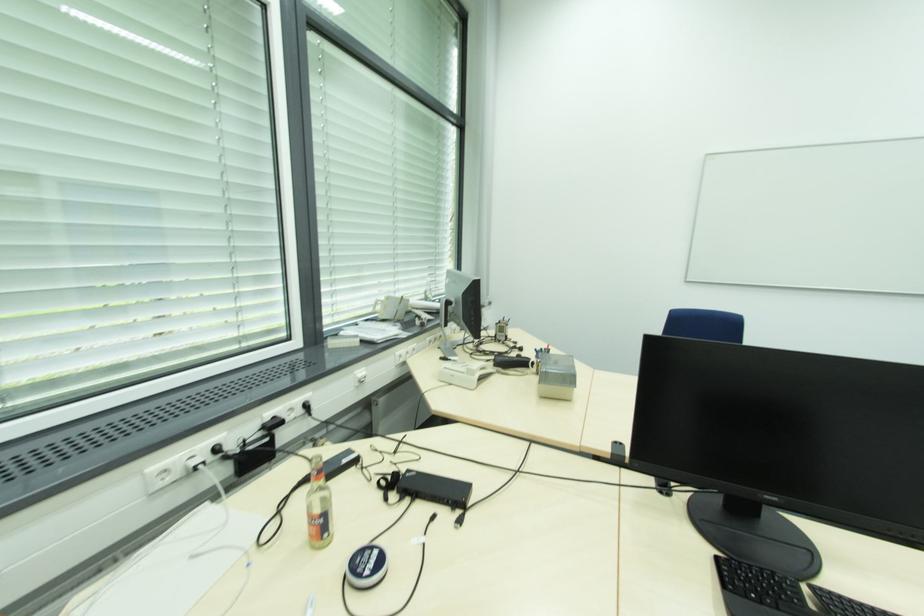
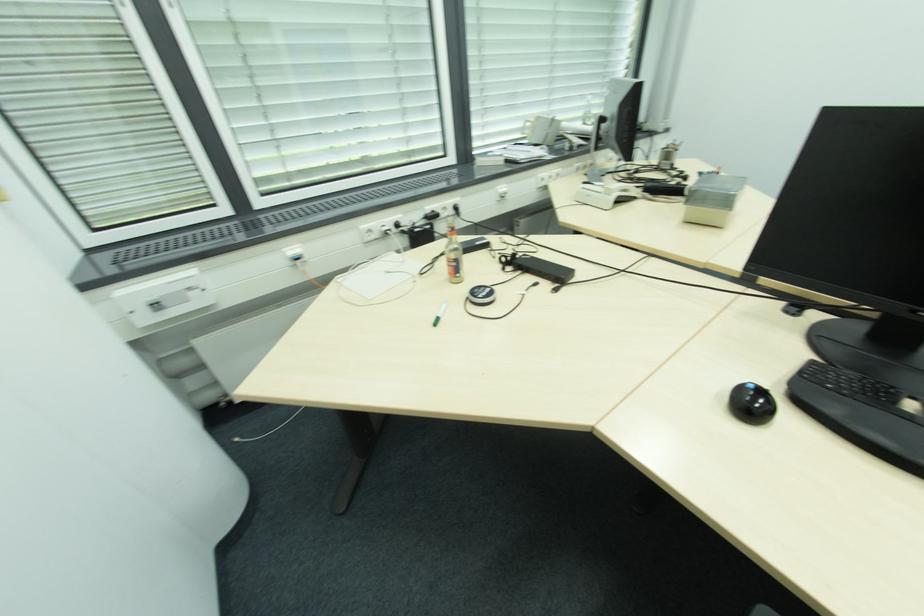
Where in the second image is the point corresponding to (329,535) from the first image?

(460, 276)